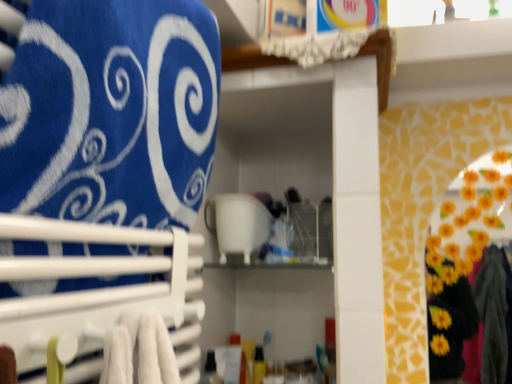
Question: Is blue fabric towel at upper left bigger or smaller than white glossy cup at center?

Choices:
 (A) small
 (B) big

Answer: (B)

Question: Considering the positions of point (77, 91) and point (252, 235), is point (77, 91) closer or farther from the camera than point (252, 235)?

Choices:
 (A) closer
 (B) farther

Answer: (A)

Question: Considering the real-world distances, which object is closest to the white glossy cup at center?

Choices:
 (A) blue fabric towel at upper left
 (B) white plastic towel rack at left

Answer: (B)

Question: Which of these objects is positioned farthest from the blue fabric towel at upper left?

Choices:
 (A) white glossy cup at center
 (B) white plastic towel rack at left

Answer: (A)